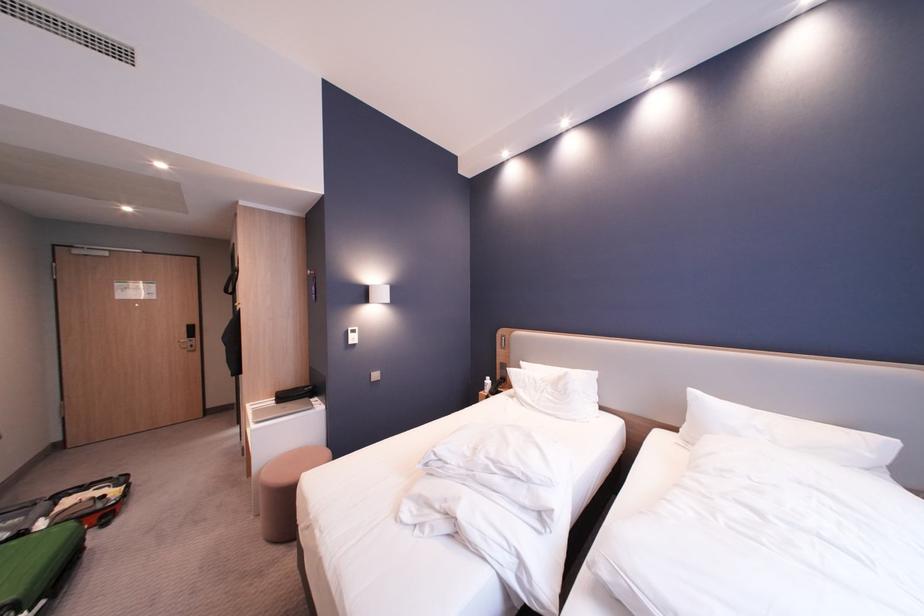
The width and height of the screenshot is (924, 616). Describe the element at coordinates (188, 342) in the screenshot. I see `a black door handle` at that location.